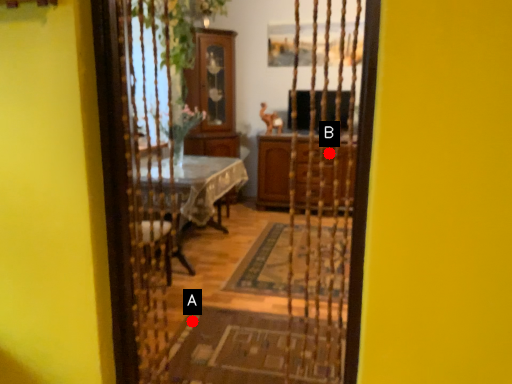
Question: Two points are circled on the image, labeled by A and B beside each circle. Among these points, which one is farthest from the camera?

Choices:
 (A) A is further
 (B) B is further

Answer: (B)